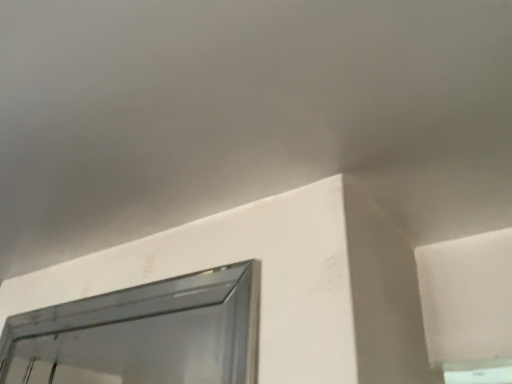
The height and width of the screenshot is (384, 512). Describe the element at coordinates (143, 334) in the screenshot. I see `metallic silver window at upper left` at that location.

At what (x,y) coordinates should I click in order to perform the action: click on metallic silver window at upper left. Please return your answer as a coordinate pair (x, y). The height and width of the screenshot is (384, 512). Looking at the image, I should click on (143, 334).

Identify the location of metallic silver window at upper left. This screenshot has width=512, height=384. (143, 334).